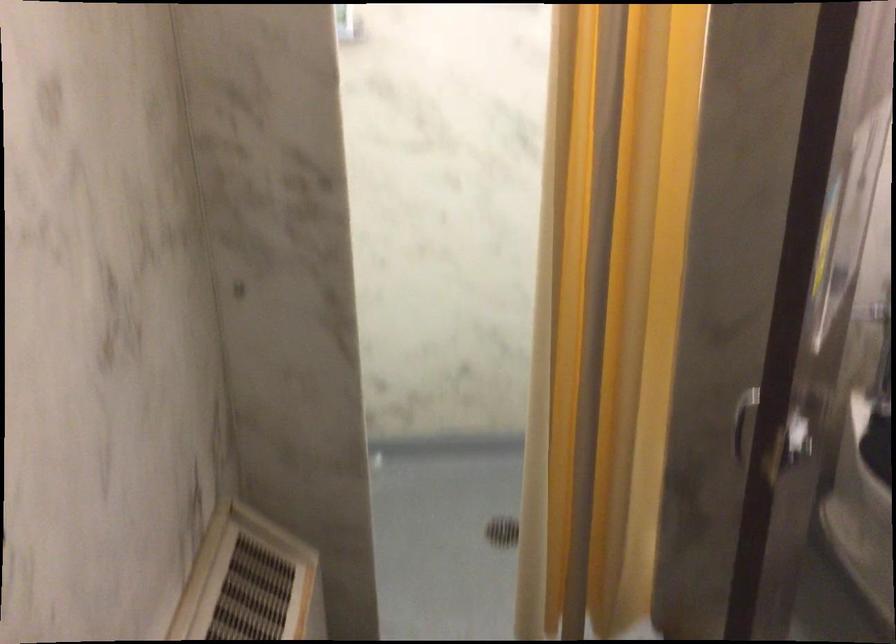
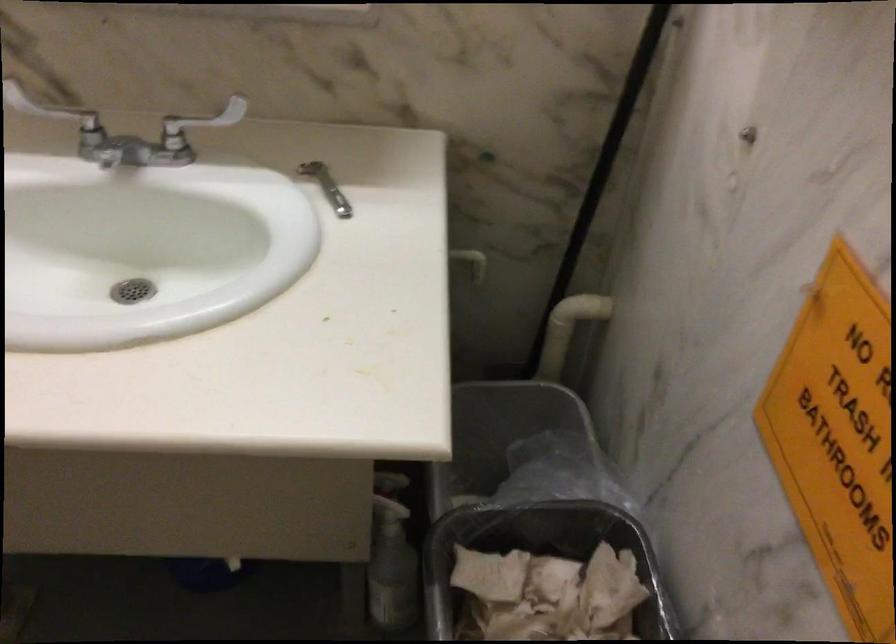
Based on the continuous images, in which direction is the camera rotating?

The camera's rotation is toward right-down.